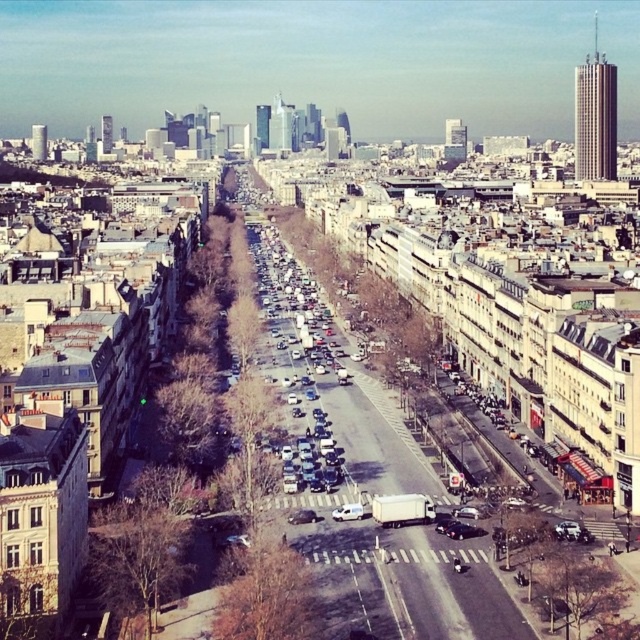
How much distance is there between white matte van at center and shiny black car at center?

A distance of 54.30 feet exists between white matte van at center and shiny black car at center.

Who is more forward, (346, 502) or (458, 524)?

Point (458, 524) is in front.

Where is `white matte van at center`? The image size is (640, 640). white matte van at center is located at coordinates point(348,512).

Does white matte van at center lie behind metallic silver car at center?

No, it is in front of metallic silver car at center.

Based on the photo, between white matte van at center and metallic silver car at center, which one has more height?

With more height is white matte van at center.

Is point (349, 509) farther from camera compared to point (305, 509)?

No, (349, 509) is closer to viewer.

At what (x,y) coordinates should I click in order to perform the action: click on white matte van at center. Please return your answer as a coordinate pair (x, y). Looking at the image, I should click on (348, 512).

Does shiny black car at center come behind metallic silver car at center?

No.

Does shiny black car at center appear on the right side of metallic silver car at center?

Yes, shiny black car at center is to the right of metallic silver car at center.

This screenshot has height=640, width=640. Find the location of `shiny black car at center`. shiny black car at center is located at coordinates (461, 531).